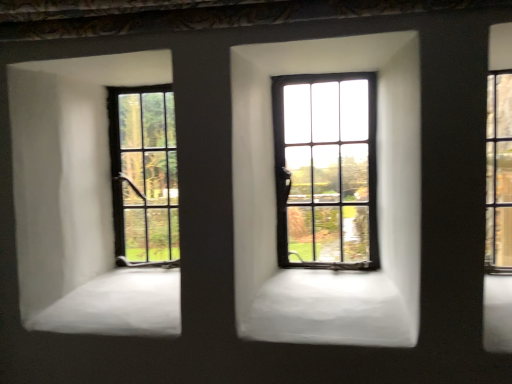
In order to face matte black window at left, which ranks as the third window in right-to-left order, should I rotate leftwards or rightwards?

Rotate your view left by about 16.566°.

This screenshot has height=384, width=512. In order to click on clear glass window at right, acting as the third window starting from the left in this screenshot , I will do `click(499, 173)`.

Find the location of a particular element. matte black window at left, the first window when ordered from left to right is located at coordinates (144, 175).

From a real-world perspective, is matte black window at left, which ranks as the third window in right-to-left order, positioned under matte black window at center, the 2th window viewed from the left, based on gravity?

Correct, in the physical world, matte black window at left, which ranks as the third window in right-to-left order, is lower than matte black window at center, the 2th window viewed from the left.

Are matte black window at left, which ranks as the third window in right-to-left order, and matte black window at center, which appears as the second window when viewed from the right, far apart?

No, matte black window at left, which ranks as the third window in right-to-left order, is not far away from matte black window at center, which appears as the second window when viewed from the right.

Can you confirm if matte black window at left, the first window when ordered from left to right, is taller than matte black window at center, which appears as the second window when viewed from the right?

No, matte black window at left, the first window when ordered from left to right, is not taller than matte black window at center, which appears as the second window when viewed from the right.

From the image's perspective, between matte black window at left, which ranks as the third window in right-to-left order, and matte black window at center, the 2th window viewed from the left, who is located below?

matte black window at left, which ranks as the third window in right-to-left order.

Between matte black window at left, the first window when ordered from left to right, and clear glass window at right, which appears as the first window when viewed from the right, which one has larger size?

With larger size is matte black window at left, the first window when ordered from left to right.

How different are the orientations of matte black window at left, the first window when ordered from left to right, and clear glass window at right, which appears as the first window when viewed from the right, in degrees?

0.00911 degrees separate the facing orientations of matte black window at left, the first window when ordered from left to right, and clear glass window at right, which appears as the first window when viewed from the right.

Based on the photo, is matte black window at left, the first window when ordered from left to right, with clear glass window at right, which appears as the first window when viewed from the right?

matte black window at left, the first window when ordered from left to right, and clear glass window at right, which appears as the first window when viewed from the right, are clearly separated.

Locate an element on the screen. the 2nd window behind the clear glass window at right, which appears as the first window when viewed from the right is located at coordinates (144, 175).

Looking at this image, which of these two, matte black window at center, the 2th window viewed from the left, or clear glass window at right, acting as the third window starting from the left, is bigger?

matte black window at center, the 2th window viewed from the left, is bigger.

Is matte black window at center, the 2th window viewed from the left, inside or outside of clear glass window at right, which appears as the first window when viewed from the right?

matte black window at center, the 2th window viewed from the left, is located beyond the bounds of clear glass window at right, which appears as the first window when viewed from the right.

Can you confirm if matte black window at center, which appears as the second window when viewed from the right, is shorter than clear glass window at right, acting as the third window starting from the left?

No, matte black window at center, which appears as the second window when viewed from the right, is not shorter than clear glass window at right, acting as the third window starting from the left.

From the image's perspective, which one is positioned lower, clear glass window at right, acting as the third window starting from the left, or matte black window at left, which ranks as the third window in right-to-left order?

From the image's view, matte black window at left, which ranks as the third window in right-to-left order, is below.

Which is more to the left, clear glass window at right, which appears as the first window when viewed from the right, or matte black window at left, which ranks as the third window in right-to-left order?

matte black window at left, which ranks as the third window in right-to-left order.

Can you confirm if clear glass window at right, which appears as the first window when viewed from the right, is wider than matte black window at left, which ranks as the third window in right-to-left order?

No, clear glass window at right, which appears as the first window when viewed from the right, is not wider than matte black window at left, which ranks as the third window in right-to-left order.

Between clear glass window at right, acting as the third window starting from the left, and matte black window at left, which ranks as the third window in right-to-left order, which one has less height?

With less height is clear glass window at right, acting as the third window starting from the left.

How far apart are clear glass window at right, acting as the third window starting from the left, and matte black window at center, which appears as the second window when viewed from the right?

18.69 inches.

Can you confirm if clear glass window at right, which appears as the first window when viewed from the right, is taller than matte black window at center, the 2th window viewed from the left?

Incorrect, the height of clear glass window at right, which appears as the first window when viewed from the right, is not larger of that of matte black window at center, the 2th window viewed from the left.

Based on their sizes in the image, would you say clear glass window at right, which appears as the first window when viewed from the right, is bigger or smaller than matte black window at center, which appears as the second window when viewed from the right?

clear glass window at right, which appears as the first window when viewed from the right, is smaller than matte black window at center, which appears as the second window when viewed from the right.

Is clear glass window at right, acting as the third window starting from the left, next to matte black window at center, the 2th window viewed from the left?

No, clear glass window at right, acting as the third window starting from the left, is not in contact with matte black window at center, the 2th window viewed from the left.

Considering their positions, is matte black window at center, the 2th window viewed from the left, located in front of or behind matte black window at left, which ranks as the third window in right-to-left order?

Clearly, matte black window at center, the 2th window viewed from the left, is in front of matte black window at left, which ranks as the third window in right-to-left order.

Considering the sizes of objects matte black window at center, the 2th window viewed from the left, and matte black window at left, the first window when ordered from left to right, in the image provided, who is wider, matte black window at center, the 2th window viewed from the left, or matte black window at left, the first window when ordered from left to right,?

matte black window at center, the 2th window viewed from the left.

Is matte black window at center, the 2th window viewed from the left, aimed at matte black window at left, which ranks as the third window in right-to-left order?

No, matte black window at center, the 2th window viewed from the left, is not turned towards matte black window at left, which ranks as the third window in right-to-left order.

From a real-world perspective, is matte black window at center, the 2th window viewed from the left, positioned over matte black window at left, the first window when ordered from left to right, based on gravity?

Yes, from a real-world perspective, matte black window at center, the 2th window viewed from the left, is above matte black window at left, the first window when ordered from left to right.

Starting from the matte black window at left, which ranks as the third window in right-to-left order, which window is the 1st one in front? Please provide its 2D coordinates.

[(326, 170)]

From a real-world perspective, starting from the matte black window at left, the first window when ordered from left to right, which window is the 1st one vertically above it? Please provide its 2D coordinates.

[(499, 173)]

From the image, which object appears to be nearer to clear glass window at right, which appears as the first window when viewed from the right, matte black window at left, the first window when ordered from left to right, or matte black window at center, which appears as the second window when viewed from the right?

Among the two, matte black window at center, which appears as the second window when viewed from the right, is located nearer to clear glass window at right, which appears as the first window when viewed from the right.

Looking at the image, which one is located further to matte black window at left, which ranks as the third window in right-to-left order, clear glass window at right, which appears as the first window when viewed from the right, or matte black window at center, which appears as the second window when viewed from the right?

clear glass window at right, which appears as the first window when viewed from the right.

From the image, which object appears to be farther from matte black window at left, the first window when ordered from left to right, matte black window at center, the 2th window viewed from the left, or clear glass window at right, acting as the third window starting from the left?

The object further to matte black window at left, the first window when ordered from left to right, is clear glass window at right, acting as the third window starting from the left.

Which object lies nearer to the anchor point matte black window at center, which appears as the second window when viewed from the right, clear glass window at right, acting as the third window starting from the left, or matte black window at left, which ranks as the third window in right-to-left order?

matte black window at left, which ranks as the third window in right-to-left order, is closer to matte black window at center, which appears as the second window when viewed from the right.

From the image, which object appears to be farther from matte black window at center, the 2th window viewed from the left, matte black window at left, which ranks as the third window in right-to-left order, or clear glass window at right, acting as the third window starting from the left?

clear glass window at right, acting as the third window starting from the left, lies further to matte black window at center, the 2th window viewed from the left, than the other object.

Considering their positions, is matte black window at center, the 2th window viewed from the left, positioned closer to clear glass window at right, which appears as the first window when viewed from the right, than matte black window at left, which ranks as the third window in right-to-left order?

matte black window at center, the 2th window viewed from the left, lies closer to clear glass window at right, which appears as the first window when viewed from the right, than the other object.

I want to click on window between matte black window at left, which ranks as the third window in right-to-left order, and clear glass window at right, acting as the third window starting from the left, so click(x=326, y=170).